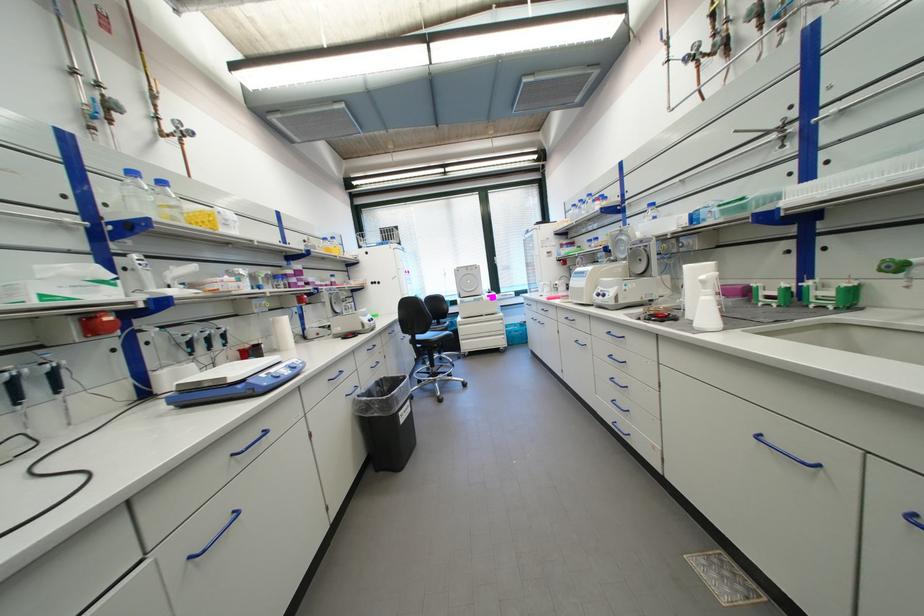
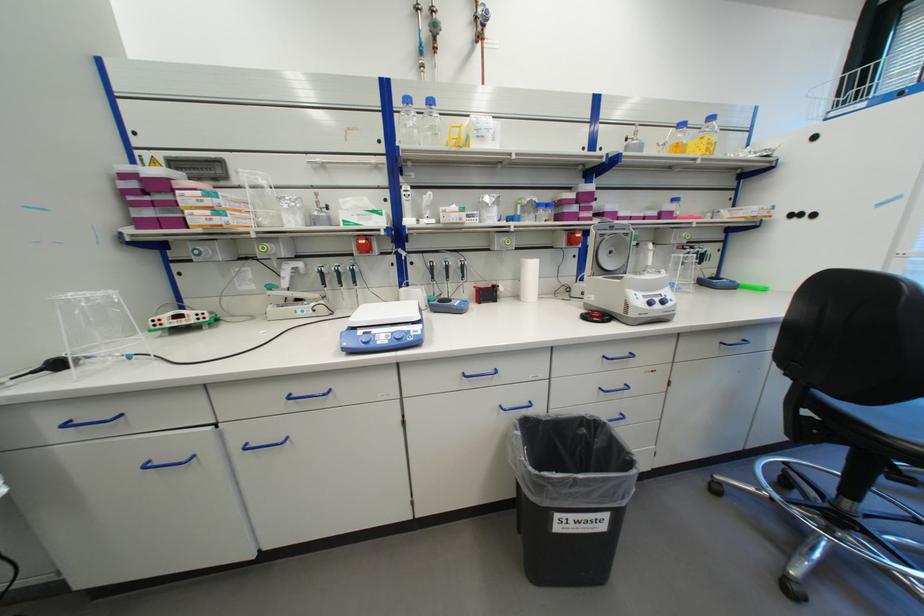
Locate, in the second image, the point that corresponds to pixel 101 331 in the first image.

(373, 249)